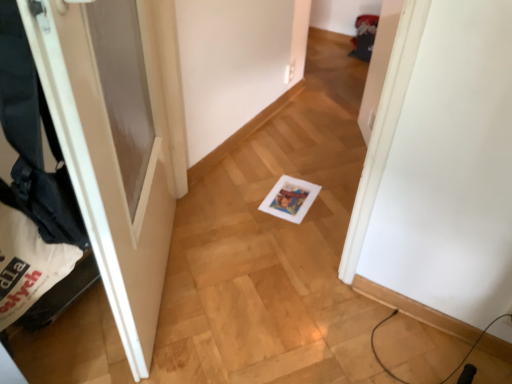
The height and width of the screenshot is (384, 512). Describe the element at coordinates (119, 143) in the screenshot. I see `white matte door at left` at that location.

This screenshot has height=384, width=512. I want to click on white matte door at left, so click(119, 143).

In order to click on black fabric laundry at left in this screenshot , I will do `click(33, 143)`.

What is the approximate width of black fabric laundry at left?

The width of black fabric laundry at left is 5.77 inches.

Describe the element at coordinates (33, 143) in the screenshot. Image resolution: width=512 pixels, height=384 pixels. I see `black fabric laundry at left` at that location.

This screenshot has height=384, width=512. Identify the location of white matte door at left. (119, 143).

Is black fabric laundry at left at the left side of white matte door at left?

Indeed, black fabric laundry at left is positioned on the left side of white matte door at left.

In the image, is black fabric laundry at left positioned in front of or behind white matte door at left?

black fabric laundry at left is in front of white matte door at left.

Is point (6, 292) farther from viewer compared to point (64, 131)?

Yes, point (6, 292) is behind point (64, 131).

From the image's perspective, would you say black fabric laundry at left is positioned over white matte door at left?

No, from the image's perspective, black fabric laundry at left is not over white matte door at left.

From a real-world perspective, does black fabric laundry at left stand above white matte door at left?

Indeed, from a real-world perspective, black fabric laundry at left stands above white matte door at left.

Looking at their sizes, would you say black fabric laundry at left is wider or thinner than white matte door at left?

In the image, black fabric laundry at left appears to be more narrow than white matte door at left.

From the picture: Considering the sizes of black fabric laundry at left and white matte door at left in the image, is black fabric laundry at left taller or shorter than white matte door at left?

In the image, black fabric laundry at left appears to be shorter than white matte door at left.

Is black fabric laundry at left bigger or smaller than white matte door at left?

In the image, black fabric laundry at left appears to be smaller than white matte door at left.

Is white matte door at left inside black fabric laundry at left?

No.

Is black fabric laundry at left not near white matte door at left?

They are positioned close to each other.

Does black fabric laundry at left turn towards white matte door at left?

Yes, black fabric laundry at left is facing white matte door at left.

How many degrees apart are the facing directions of black fabric laundry at left and white matte door at left?

black fabric laundry at left and white matte door at left are facing 31.6 degrees away from each other.

Identify the location of laundry located below the white matte door at left (from the image's perspective). (33, 143).

Which object is positioned more to the right, white matte door at left or black fabric laundry at left?

white matte door at left.

Who is more distant, white matte door at left or black fabric laundry at left?

white matte door at left is behind.

Which is in front, point (49, 63) or point (9, 2)?

Point (9, 2)

From the image's perspective, is white matte door at left located above or below black fabric laundry at left?

From the image's perspective, white matte door at left appears above black fabric laundry at left.

From a real-world perspective, is white matte door at left above or below black fabric laundry at left?

white matte door at left is situated lower than black fabric laundry at left in the real world.

Considering the relative sizes of white matte door at left and black fabric laundry at left in the image provided, is white matte door at left thinner than black fabric laundry at left?

No.

Considering the relative sizes of white matte door at left and black fabric laundry at left in the image provided, is white matte door at left taller than black fabric laundry at left?

Correct, white matte door at left is much taller as black fabric laundry at left.

Considering the sizes of objects white matte door at left and black fabric laundry at left in the image provided, who is bigger, white matte door at left or black fabric laundry at left?

Bigger between the two is white matte door at left.

Would you say white matte door at left contains black fabric laundry at left?

That's correct, black fabric laundry at left is inside white matte door at left.

Are white matte door at left and black fabric laundry at left far apart?

Actually, white matte door at left and black fabric laundry at left are a little close together.

Is white matte door at left positioned with its back to black fabric laundry at left?

Absolutely, white matte door at left is directed away from black fabric laundry at left.

How many degrees apart are the facing directions of white matte door at left and black fabric laundry at left?

They differ by 31.6 degrees in their facing directions.

This screenshot has width=512, height=384. I want to click on door behind the black fabric laundry at left, so click(119, 143).

You are a GUI agent. You are given a task and a screenshot of the screen. Output one action in this format:
    pyautogui.click(x=<x>, y=<y>)
    Task: Click on the door lying behind the black fabric laundry at left
    The height and width of the screenshot is (384, 512).
    Given the screenshot: What is the action you would take?
    pyautogui.click(x=119, y=143)

The width and height of the screenshot is (512, 384). What are the coordinates of `door above the black fabric laundry at left (from the image's perspective)` in the screenshot? It's located at (119, 143).